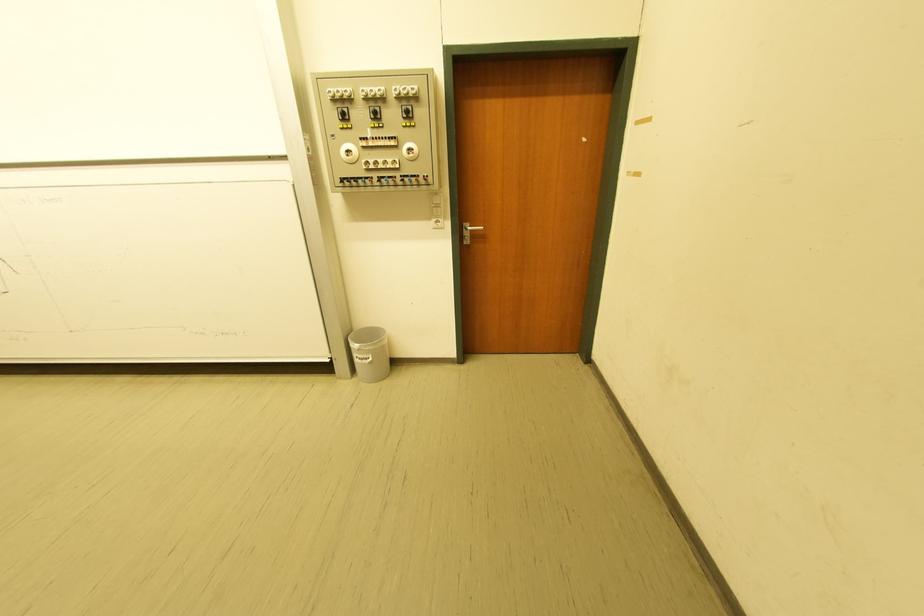
The height and width of the screenshot is (616, 924). Identify the location of silver door handle. (468, 232).